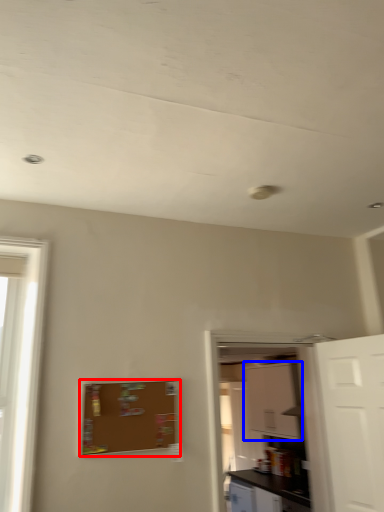
Question: Which object is closer to the camera taking this photo, bulletin board (highlighted by a red box) or cabinetry (highlighted by a blue box)?

Choices:
 (A) bulletin board
 (B) cabinetry

Answer: (A)